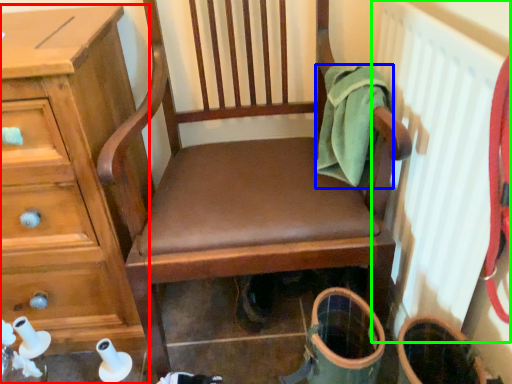
Question: Considering the real-world distances, which object is closest to chest of drawers (highlighted by a red box)? clothing (highlighted by a blue box) or radiator (highlighted by a green box).

Choices:
 (A) clothing
 (B) radiator

Answer: (A)